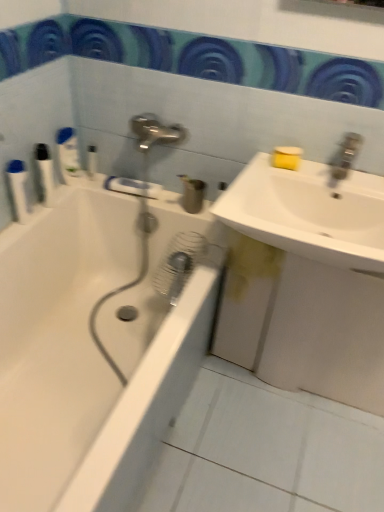
Question: Looking at their shapes, would you say white ceramic tile at lower center is wider or thinner than white plastic bottles at left, acting as the fourth toiletry starting from the right?

Choices:
 (A) wide
 (B) thin

Answer: (A)

Question: From a real-world perspective, is white ceramic tile at lower center above or below white plastic bottles at left, acting as the fourth toiletry starting from the right?

Choices:
 (A) below
 (B) above

Answer: (A)

Question: Estimate the real-world distances between objects in this image. Which object is farther from the white glossy bathtub at left?

Choices:
 (A) white plastic bottles at left, acting as the 5th toiletry starting from the right
 (B) white plastic bottle at upper left, acting as the 3th toiletry starting from the right
 (C) white matte sink at right, acting as the first sink starting from the bottom
 (D) satin nickel faucet at upper right
 (E) white plastic bottles at left, the second toiletry viewed from the left

Answer: (D)

Question: Estimate the real-world distances between objects in this image. Which object is farther from the white glossy bathtub at left?

Choices:
 (A) matte plastic cup at center, placed as the first toiletry when sorted from right to left
 (B) white plastic bottle at upper left, which ranks as the second toiletry in right-to-left order
 (C) white matte sink at right, which appears as the 2th sink when viewed from the top
 (D) white glossy sink at upper right, placed as the first sink when sorted from top to bottom
 (E) white ceramic tile at lower center

Answer: (B)